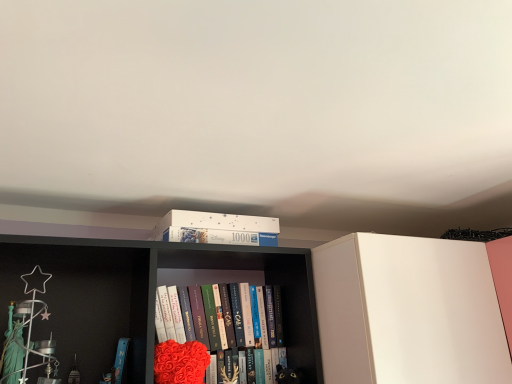
Locate an element on the screen. This screenshot has width=512, height=384. blank space situated above hardcover book at center (from a real-world perspective) is located at coordinates (223, 286).